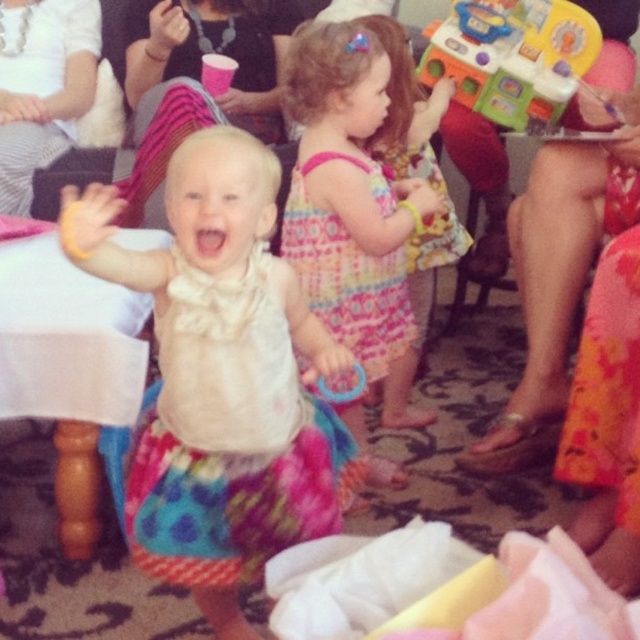
You are a photographer at a children party. You want to capture a photo of the two girls wearing the matte white dress at center and the printed cotton dress at center. However, you notice that one of the dresses is blocking the other. Which dress is currently blocking the other?

The matte white dress at center is blocking the printed cotton dress at center because it is positioned in front of it.

You are a photographer at a childrens party. You want to take a photo of the two girls wearing the matte white dress at center and the pastel floral dress at center. Which girl should you focus on first to ensure both are in focus?

You should focus on the matte white dress at center first because it is closer to the viewer, ensuring both dresses will be in focus when using a proper depth of field.

You are a photographer at the party and want to capture a clear shot of both the matte white dress at center and the multicolored plastic toy at upper right. Which object will appear larger in the photo?

The matte white dress at center will appear larger in the photo because it is closer to the viewer than the multicolored plastic toy at upper right.